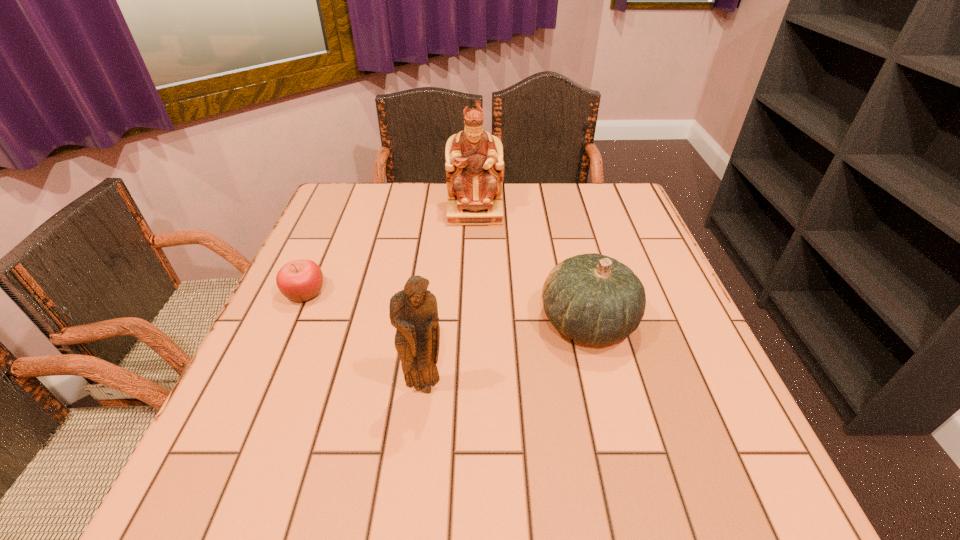
This screenshot has width=960, height=540. Find the location of `the farther figurine`. the farther figurine is located at coordinates (474, 165).

This screenshot has height=540, width=960. What are the coordinates of `the nearest object` in the screenshot? It's located at (413, 311).

Find the location of `gourd`. gourd is located at coordinates (591, 298).

The image size is (960, 540). What are the coordinates of `the second shortest object` in the screenshot? It's located at (591, 298).

I want to click on the shortest object, so click(299, 280).

I want to click on apple, so click(x=299, y=280).

Locate an element on the screen. blank space located on the front-facing side of the farthest object is located at coordinates (474, 254).

This screenshot has height=540, width=960. In order to click on vacant space positioned on the front-facing side of the nearer figurine in this screenshot , I will do `click(413, 495)`.

Image resolution: width=960 pixels, height=540 pixels. I want to click on free spot located on the left of the third tallest object, so click(x=353, y=322).

You are a GUI agent. You are given a task and a screenshot of the screen. Output one action in this format:
    pyautogui.click(x=<x>, y=<y>)
    Task: Click on the vacant space located 0.270m on the front of the leftmost object
    
    Given the screenshot: What is the action you would take?
    pyautogui.click(x=250, y=422)